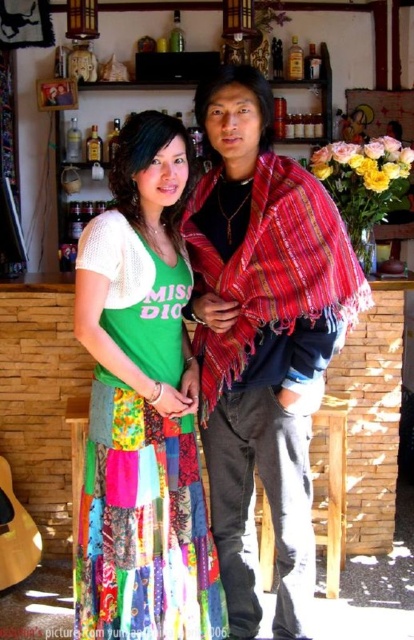
Based on the photo, can you confirm if colorful patchwork skirt at center is positioned to the right of red woven shawl at center?

No, colorful patchwork skirt at center is not to the right of red woven shawl at center.

Does colorful patchwork skirt at center have a lesser height compared to red woven shawl at center?

In fact, colorful patchwork skirt at center may be taller than red woven shawl at center.

The width and height of the screenshot is (414, 640). I want to click on colorful patchwork skirt at center, so click(142, 525).

Is multicolored patchwork skirt at center positioned behind red woven shawl at center?

Yes, multicolored patchwork skirt at center is further from the viewer.

Does multicolored patchwork skirt at center have a greater height compared to red woven shawl at center?

Yes.

Does point (286, 253) lie behind point (211, 337)?

No, it is in front of (211, 337).

Where is `multicolored patchwork skirt at center`? The width and height of the screenshot is (414, 640). multicolored patchwork skirt at center is located at coordinates (262, 339).

I want to click on multicolored patchwork skirt at center, so pyautogui.click(x=262, y=339).

Who is more distant from viewer, (226, 577) or (147, 452)?

Positioned behind is point (226, 577).

Measure the distance between multicolored patchwork skirt at center and camera.

A distance of 5.00 feet exists between multicolored patchwork skirt at center and camera.

Where is `multicolored patchwork skirt at center`? The image size is (414, 640). multicolored patchwork skirt at center is located at coordinates (262, 339).